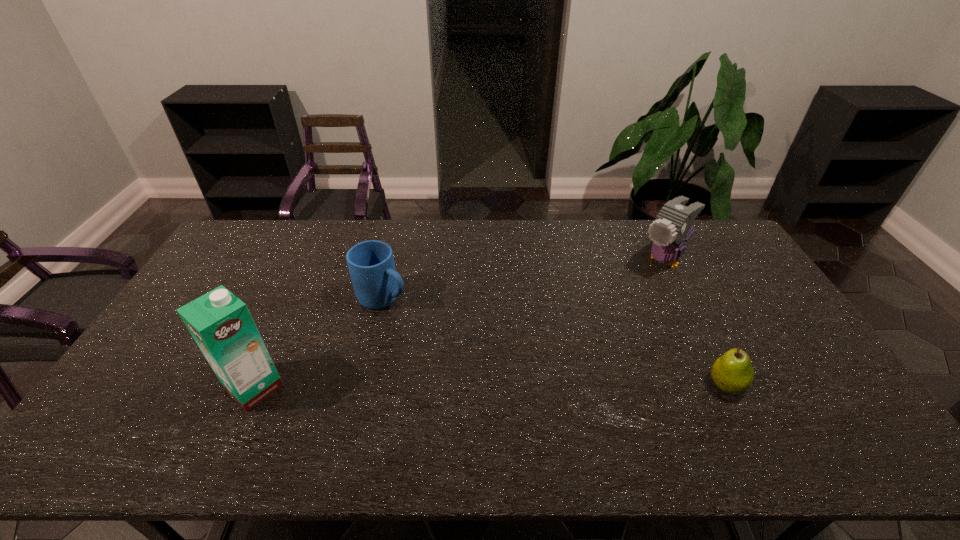
Locate an element on the screen. vacant space at the left edge of the desktop is located at coordinates (239, 296).

The height and width of the screenshot is (540, 960). In order to click on free space at the right edge of the desktop in this screenshot , I will do `click(727, 264)`.

I want to click on free point at the far left corner, so click(x=222, y=253).

The width and height of the screenshot is (960, 540). In the image, there is a desktop. Find the location of `free space at the near left corner`. free space at the near left corner is located at coordinates point(149,389).

You are a GUI agent. You are given a task and a screenshot of the screen. Output one action in this format:
    pyautogui.click(x=<x>, y=<y>)
    Task: Click on the vacant space at the near right corner of the desktop
    
    Given the screenshot: What is the action you would take?
    pyautogui.click(x=811, y=406)

Image resolution: width=960 pixels, height=540 pixels. I want to click on vacant area that lies between the tallest object and the second tallest object, so click(x=460, y=324).

Find the location of a particular element. vacant point located between the tallest object and the second shortest object is located at coordinates (319, 343).

Locate an element on the screen. unoccupied position between the leftmost object and the pear is located at coordinates (491, 386).

Find the location of a particular element. unoccupied position between the pear and the third tallest object is located at coordinates (555, 341).

Locate an element on the screen. blank region between the second farthest object and the shortest object is located at coordinates (555, 341).